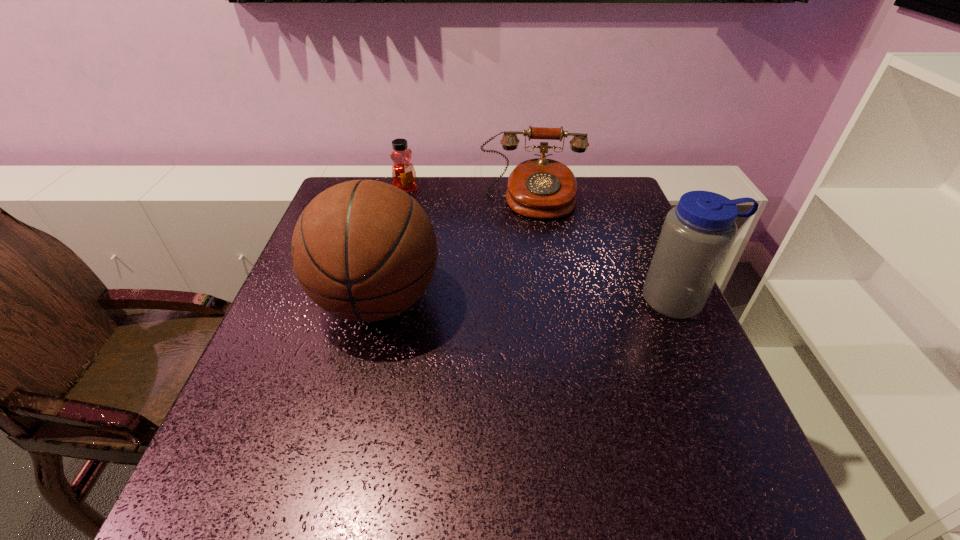
Locate an element on the screen. Image resolution: width=960 pixels, height=540 pixels. vacant space at the right edge of the desktop is located at coordinates (642, 231).

Locate an element on the screen. The width and height of the screenshot is (960, 540). vacant area at the far right corner of the desktop is located at coordinates (578, 207).

The image size is (960, 540). I want to click on free space at the near right corner of the desktop, so click(x=683, y=422).

Identify the location of empty location between the basketball and the water bottle. Image resolution: width=960 pixels, height=540 pixels. (528, 300).

Identify the location of empty space between the third object from left to right and the shortest object. The image size is (960, 540). (469, 195).

I want to click on vacant space that is in between the honey and the water bottle, so click(x=542, y=245).

This screenshot has width=960, height=540. What are the coordinates of `vacant space that's between the rightmost object and the shortest object` in the screenshot? It's located at (542, 245).

Image resolution: width=960 pixels, height=540 pixels. Find the location of `blank region between the shortest object and the second object from right to left`. blank region between the shortest object and the second object from right to left is located at coordinates pos(469,195).

The height and width of the screenshot is (540, 960). I want to click on empty space that is in between the honey and the second shortest object, so click(x=469, y=195).

The height and width of the screenshot is (540, 960). What are the coordinates of `free spot between the honey and the water bottle` in the screenshot? It's located at (542, 245).